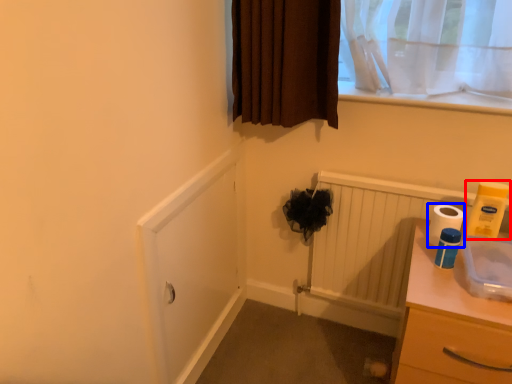
Question: Among these objects, which one is nearest to the camera, toilet paper (highlighted by a red box) or toilet paper (highlighted by a blue box)?

Choices:
 (A) toilet paper
 (B) toilet paper

Answer: (A)